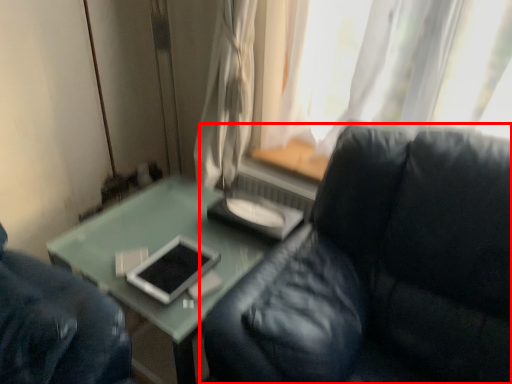
Question: Where is studio couch (annotated by the red box) located in relation to curtain in the image?

Choices:
 (A) right
 (B) left

Answer: (A)